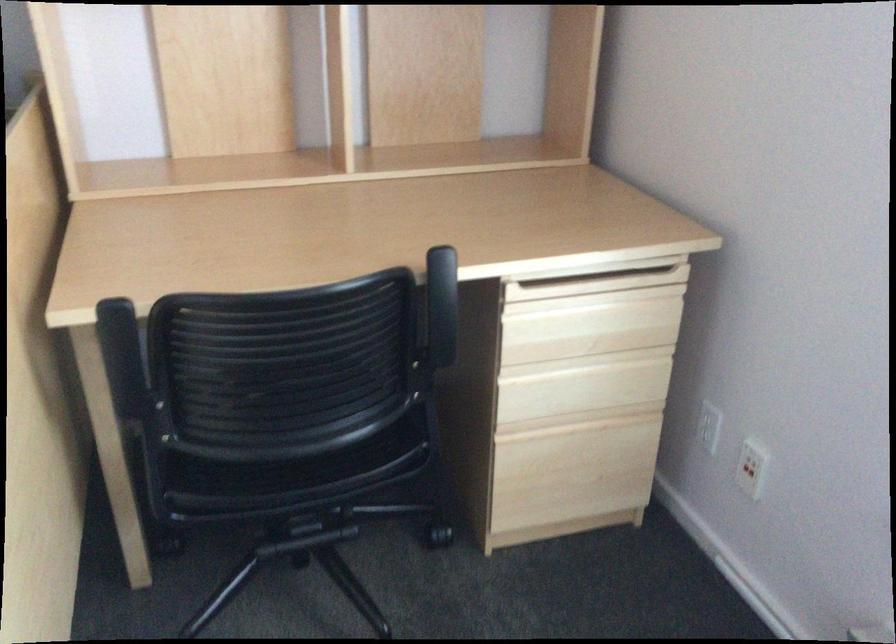
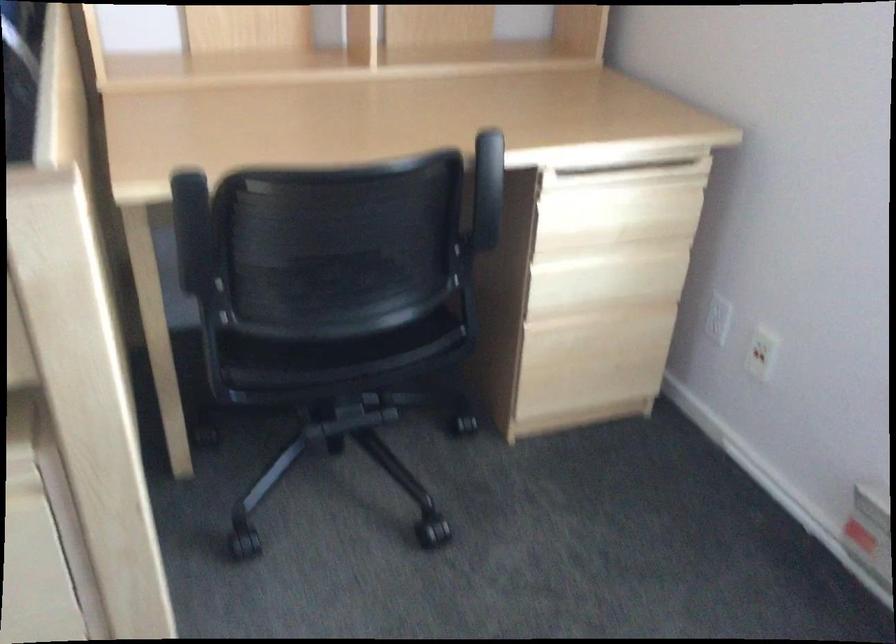
Question: Which direction would the cameraman need to move to produce the second image? Reply with the corresponding letter.

Choices:
 (A) Left
 (B) Right
 (C) Forward
 (D) Backward

Answer: (A)